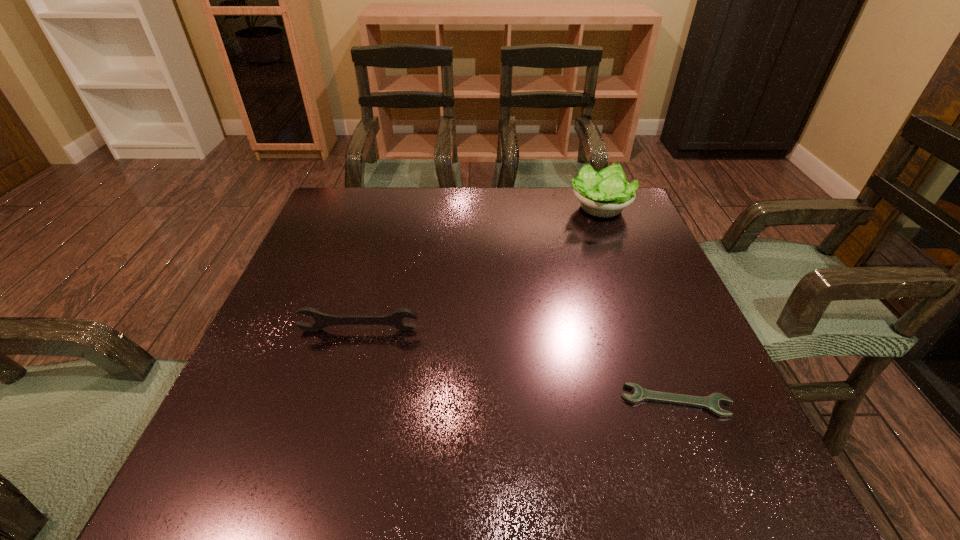
Find the location of a particular element. lettuce that is at the right edge is located at coordinates (606, 193).

Find the location of a particular element. The height and width of the screenshot is (540, 960). wrench present at the right edge is located at coordinates (711, 402).

Identify the location of object at the far right corner. [x=606, y=193].

Where is `vacant space at the far edge of the desktop`? vacant space at the far edge of the desktop is located at coordinates [x=553, y=219].

In the image, there is a desktop. Where is `vacant space at the near edge`? Image resolution: width=960 pixels, height=540 pixels. vacant space at the near edge is located at coordinates (430, 448).

In order to click on free spot at the left edge of the desktop in this screenshot , I will do `click(324, 291)`.

This screenshot has height=540, width=960. I want to click on free spot at the far right corner of the desktop, so click(601, 222).

In the image, there is a desktop. Identify the location of vacant space at the near right corner. (693, 480).

At what (x,y) coordinates should I click in order to perform the action: click on free space between the leftmost object and the right wrench. Please return your answer as a coordinate pair (x, y). The image size is (960, 540). Looking at the image, I should click on (517, 366).

Image resolution: width=960 pixels, height=540 pixels. Identify the location of free space that is in between the taller wrench and the lettuce. (479, 269).